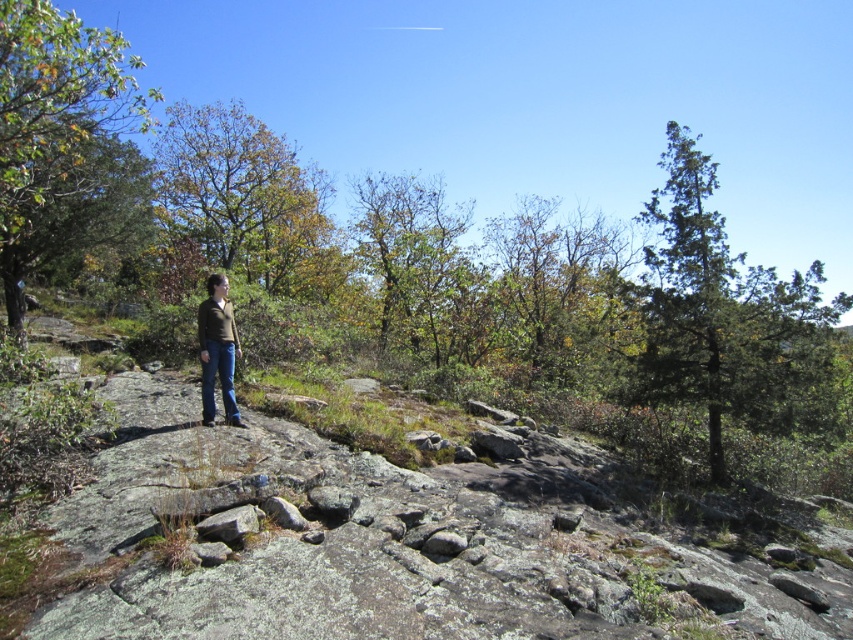
You are planning to take a photo of the brown matte jacket at center while ensuring the green coniferous tree at upper right is visible in the background. Based on their sizes, will the tree appear larger or smaller than the jacket in the photo?

The green coniferous tree at upper right is taller than the brown matte jacket at center. Since the tree is taller but likely farther away, its apparent size in the photo depends on both its actual size and distance. However, given that the tree has greater height, it might still appear larger than the jacket in the photo unless the jacket is very close to the camera and the tree is much farther away.